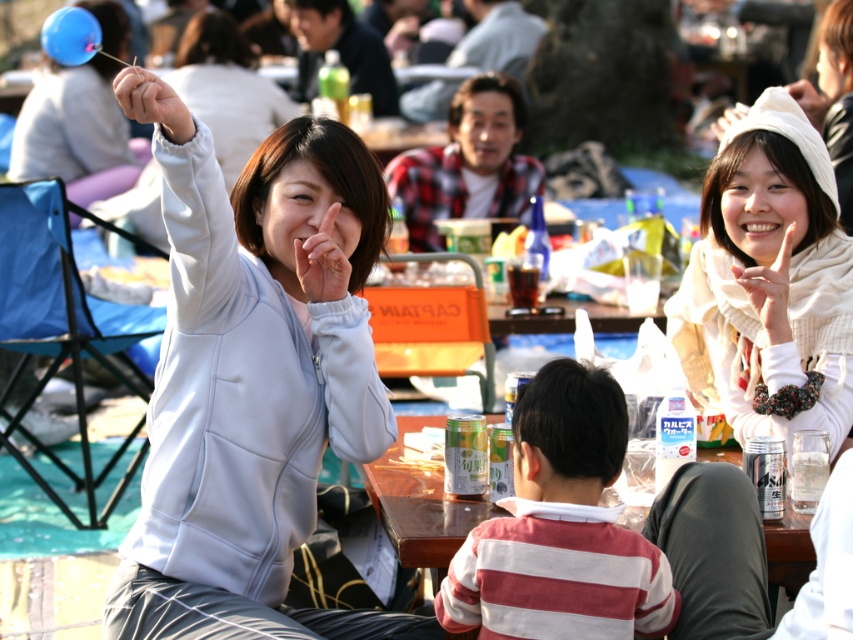
Is light blue fabric jacket at center bigger than striped cotton shirt at center?

Yes.

Which is behind, point (277, 369) or point (503, 538)?

The point (277, 369) is behind.

Is point (289, 534) more distant than point (567, 362)?

Yes, point (289, 534) is behind point (567, 362).

The height and width of the screenshot is (640, 853). Identify the location of light blue fabric jacket at center. (253, 378).

Is point (711, 326) more distant than point (450, 532)?

Yes, it is.

Is white knitted hat at upper right above wooden table at center?

Indeed, white knitted hat at upper right is positioned over wooden table at center.

The height and width of the screenshot is (640, 853). I want to click on white knitted hat at upper right, so [x=770, y=276].

Does light blue fabric jacket at center appear under wooden table at center?

Actually, light blue fabric jacket at center is above wooden table at center.

Who is shorter, light blue fabric jacket at center or wooden table at center?

wooden table at center is shorter.

Which is behind, point (149, 552) or point (733, 460)?

Positioned behind is point (733, 460).

Find the location of a particular element. light blue fabric jacket at center is located at coordinates (253, 378).